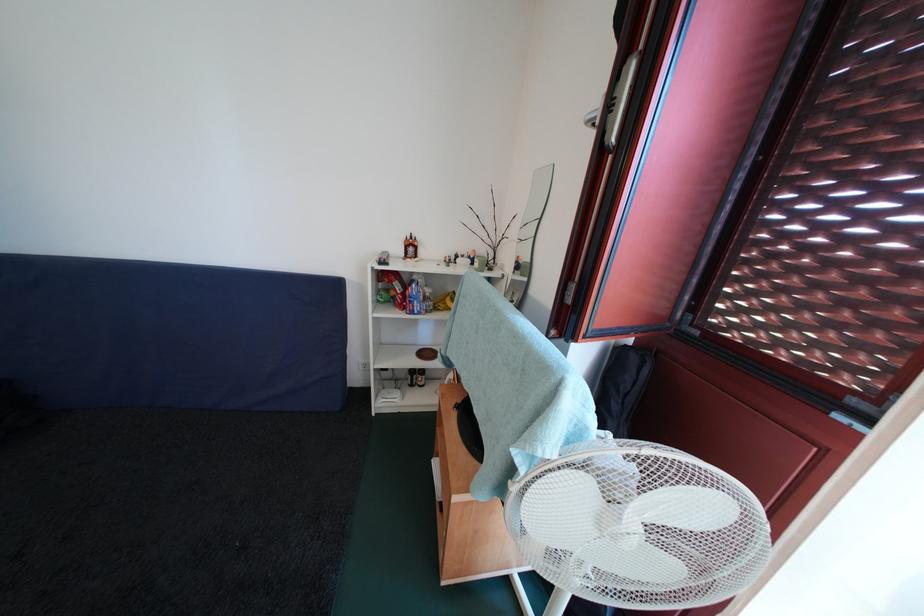
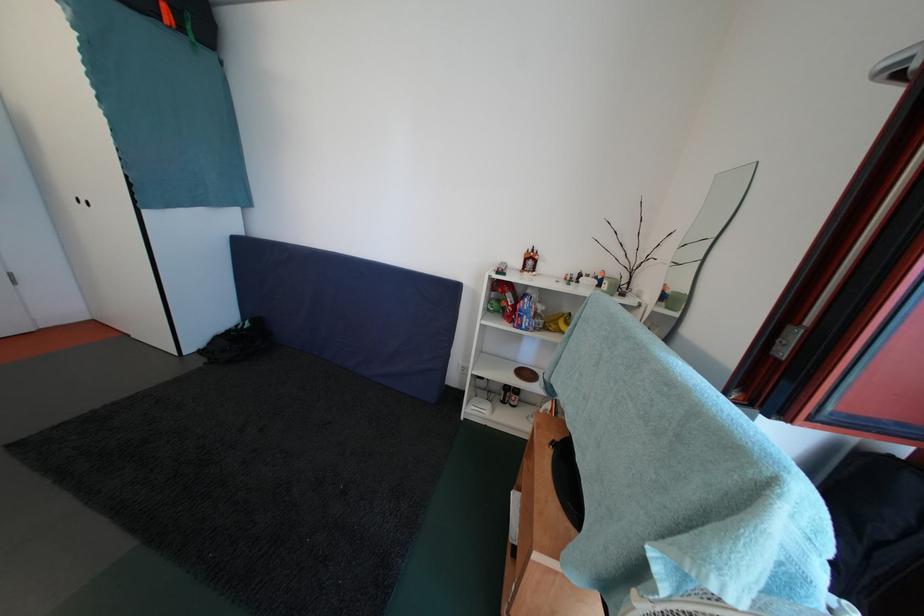
Question: The camera is either moving clockwise (left) or counter-clockwise (right) around the object. The first image is from the beginning of the video and the second image is from the end. Is the camera moving left or right when shooting the video?

Choices:
 (A) Left
 (B) Right

Answer: (B)